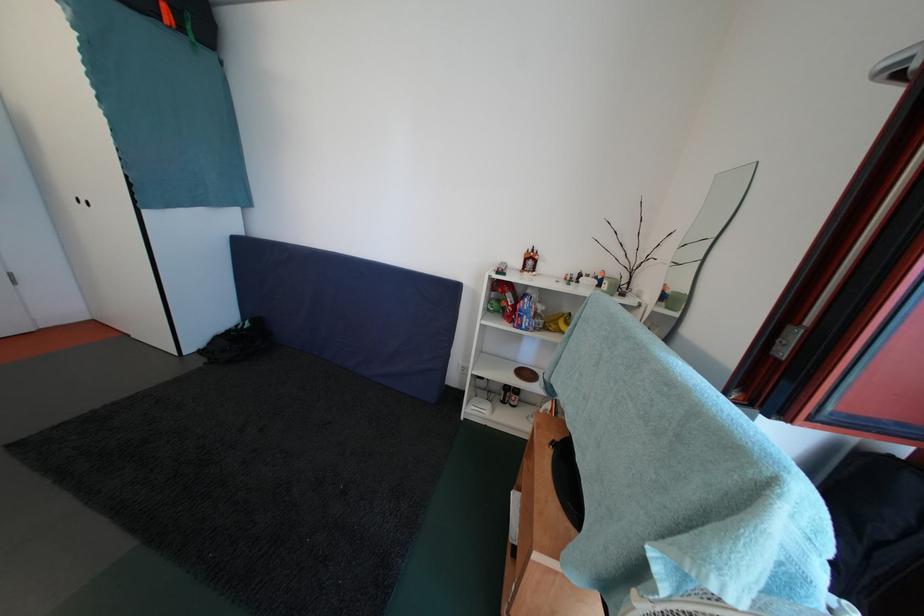
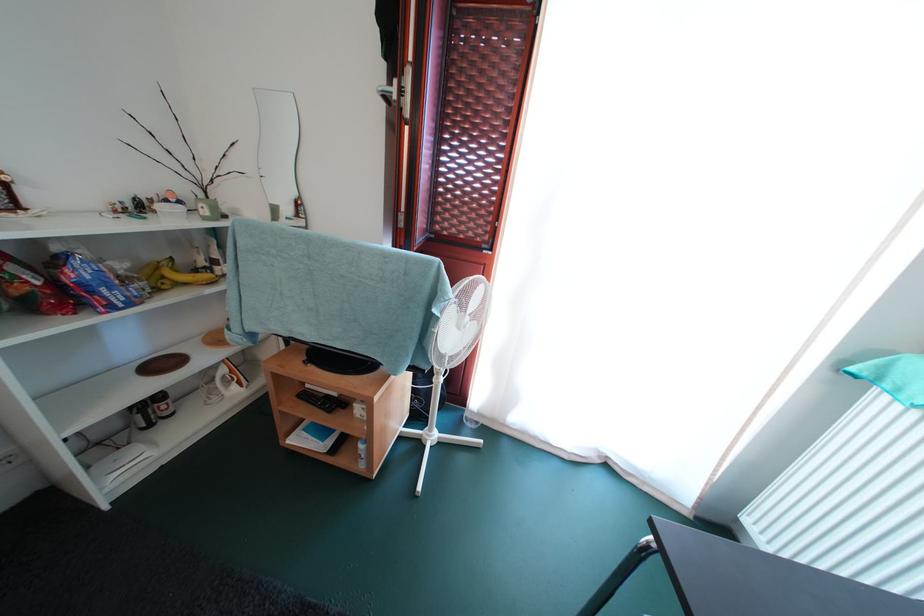
The point at (543,321) is marked in the first image. Where is the corresponding point in the second image?

(131, 285)